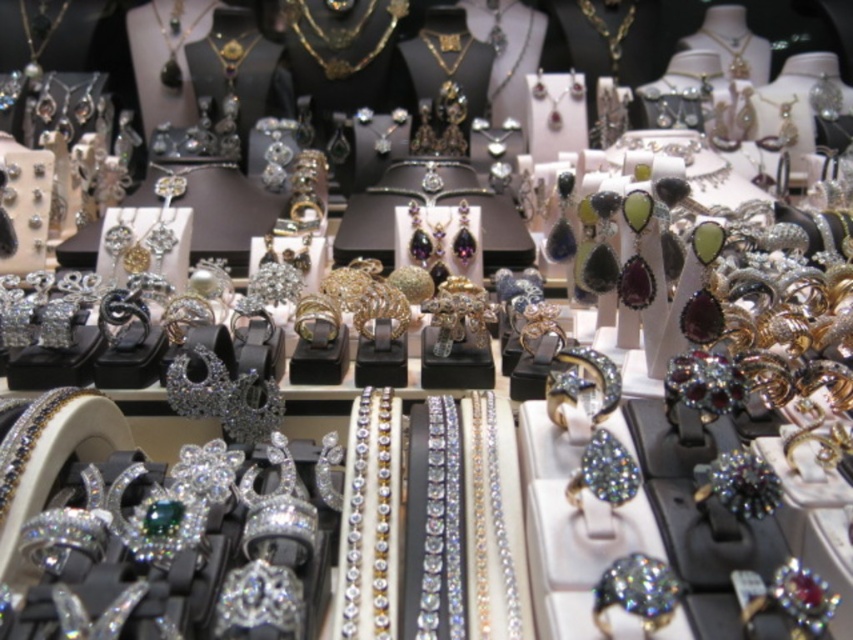
Who is more distant from viewer, (178, 12) or (457, 52)?

The point (178, 12) is more distant.

The height and width of the screenshot is (640, 853). Find the location of `matte black necklace at upper center`. matte black necklace at upper center is located at coordinates (173, 40).

Where is `matte black necklace at upper center`? This screenshot has height=640, width=853. matte black necklace at upper center is located at coordinates (173, 40).